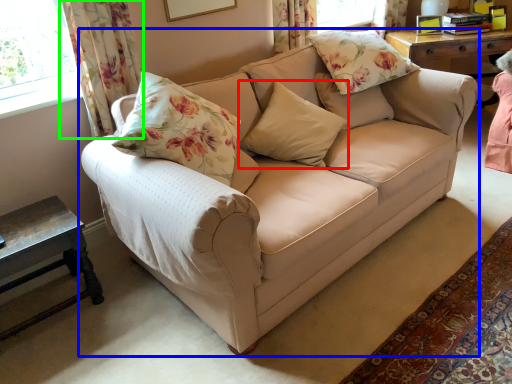
Question: Considering the real-world distances, which object is closest to pillow (highlighted by a red box)? studio couch (highlighted by a blue box) or curtain (highlighted by a green box).

Choices:
 (A) studio couch
 (B) curtain

Answer: (A)